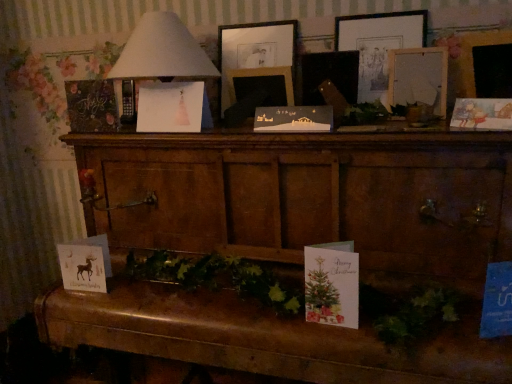
The width and height of the screenshot is (512, 384). Identify the location of free space in front of white paper christmas card at center, which appears as the third christmas card when ordered from the bottom. (303, 135).